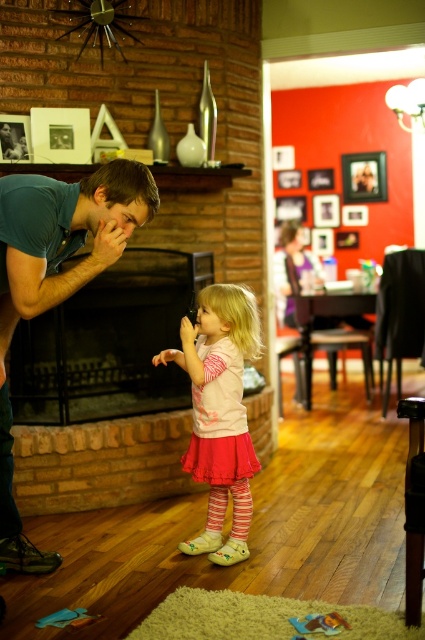
Is point (78, 420) closer to camera compared to point (370, 198)?

Yes, it is.

Who is more forward, [37,364] or [384,172]?

Point [37,364] is more forward.

The image size is (425, 640). What do you see at coordinates (108, 342) in the screenshot?
I see `black metal fireplace at left` at bounding box center [108, 342].

Identify the location of black metal fireplace at left. (108, 342).

Does matte pink skirt at center have a larger size compared to wooden picture frame at upper center?

Correct, matte pink skirt at center is larger in size than wooden picture frame at upper center.

Is matte pink skirt at center smaller than wooden picture frame at upper center?

No.

Which is in front, point (198, 477) or point (357, 193)?

Point (198, 477)

Where is `matte pink skirt at center`? This screenshot has height=640, width=425. matte pink skirt at center is located at coordinates (220, 412).

Can you confirm if black metal fireplace at left is bigger than teal cotton shirt at left?

Actually, black metal fireplace at left might be smaller than teal cotton shirt at left.

Who is lower down, black metal fireplace at left or teal cotton shirt at left?

teal cotton shirt at left

Which is behind, point (144, 387) or point (11, 502)?

Point (144, 387)

Find the location of a particular element. Image resolution: width=425 pixels, height=640 pixels. black metal fireplace at left is located at coordinates tap(108, 342).